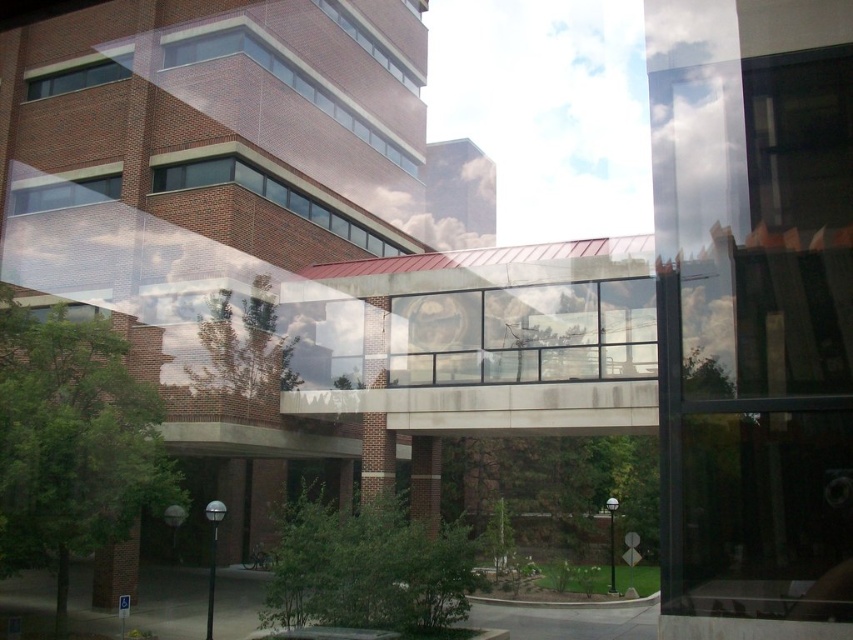
How far apart are brick wall at upper center and clear glass window at upper left?

brick wall at upper center and clear glass window at upper left are 5.56 meters apart from each other.

Is brick wall at upper center above clear glass window at upper left?

Yes, brick wall at upper center is above clear glass window at upper left.

Measure the distance between point (398, 152) and camera.

Point (398, 152) is 33.45 meters away from camera.

Find the location of a particular element. brick wall at upper center is located at coordinates (285, 83).

Does brick wall at upper center have a lesser height compared to matte glass window at upper left?

Incorrect, brick wall at upper center's height does not fall short of matte glass window at upper left's.

Consider the image. Can you confirm if brick wall at upper center is wider than matte glass window at upper left?

Correct, the width of brick wall at upper center exceeds that of matte glass window at upper left.

Describe the element at coordinates (285, 83) in the screenshot. I see `brick wall at upper center` at that location.

This screenshot has width=853, height=640. Find the location of `brick wall at upper center`. brick wall at upper center is located at coordinates (285, 83).

Does clear glass window at center have a smaller size compared to brick wall at upper center?

Yes, clear glass window at center is smaller than brick wall at upper center.

Can you confirm if clear glass window at center is shorter than brick wall at upper center?

Yes.

Who is more distant from viewer, (465,364) or (219,32)?

The point (219,32) is more distant.

Where is `clear glass window at center`? This screenshot has height=640, width=853. clear glass window at center is located at coordinates (524, 333).